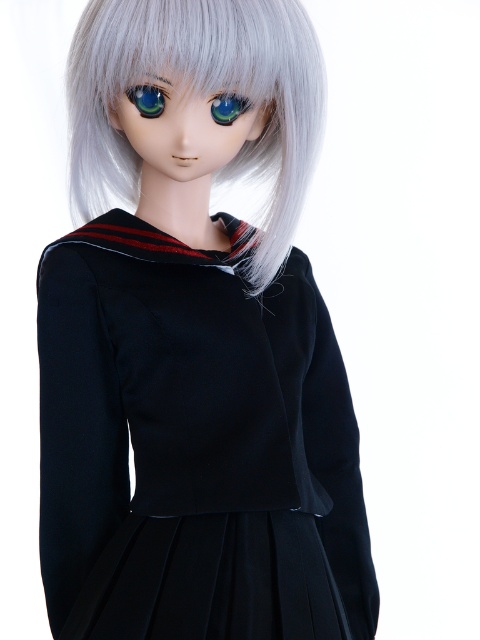
You are an artist trying to draw the doll from the image. You want to place the sleek silver hair at center accurately. What are the coordinates where you should position it?

The sleek silver hair at center should be positioned at coordinates point (201, 90).

You are a fashion designer creating a new look for the doll. You want to add a headband that sits just above the sleek silver hair at center. Where should the headband be placed in relation to the green glossy eye at center?

The sleek silver hair at center is located below the green glossy eye at center, so the headband should be placed above the sleek silver hair at center, which is below the green glossy eye at center.

You are a fashion designer examining the doll. You need to place a red bow exactly between the matte black dress at center and the green glossy eye at center. Which object should the bow be closer to?

The red bow should be placed closer to the green glossy eye at center because the matte black dress at center is positioned on the left side of the green glossy eye at center.